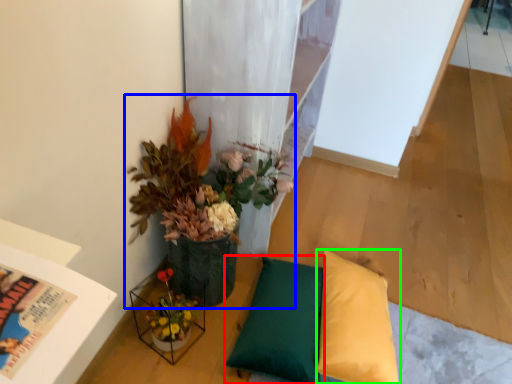
Question: Which object is the closest to the pillow (highlighted by a red box)? Choose among these: houseplant (highlighted by a blue box) or pillow (highlighted by a green box).

Choices:
 (A) houseplant
 (B) pillow

Answer: (B)